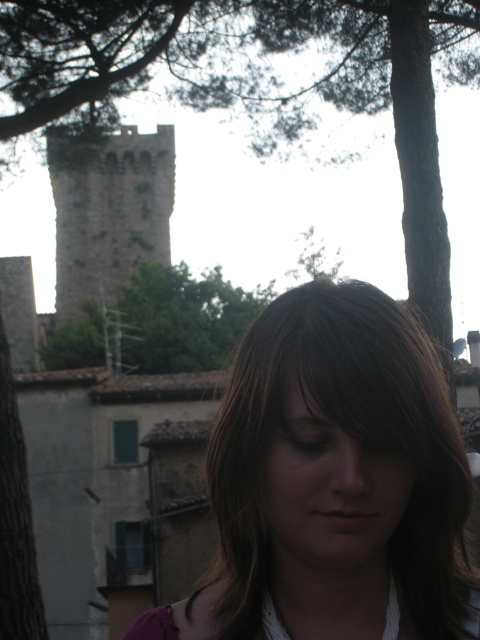
Question: Which object appears closest to the camera in this image?

Choices:
 (A) brown hair at center
 (B) green leafy tree at upper center
 (C) green leafy tree at center

Answer: (A)

Question: Does brown hair at center have a smaller size compared to stone tower at upper left?

Choices:
 (A) no
 (B) yes

Answer: (B)

Question: Which of these objects is positioned closest to the brown hair at center?

Choices:
 (A) green leafy tree at center
 (B) green leafy tree at upper center

Answer: (B)

Question: Which of the following is the farthest from the observer?

Choices:
 (A) (169, 285)
 (B) (324, 352)
 (C) (67, 157)

Answer: (A)

Question: Is brown hair at center positioned in front of green leafy tree at center?

Choices:
 (A) yes
 (B) no

Answer: (A)

Question: Does brown hair at center have a smaller size compared to stone tower at upper left?

Choices:
 (A) no
 (B) yes

Answer: (B)